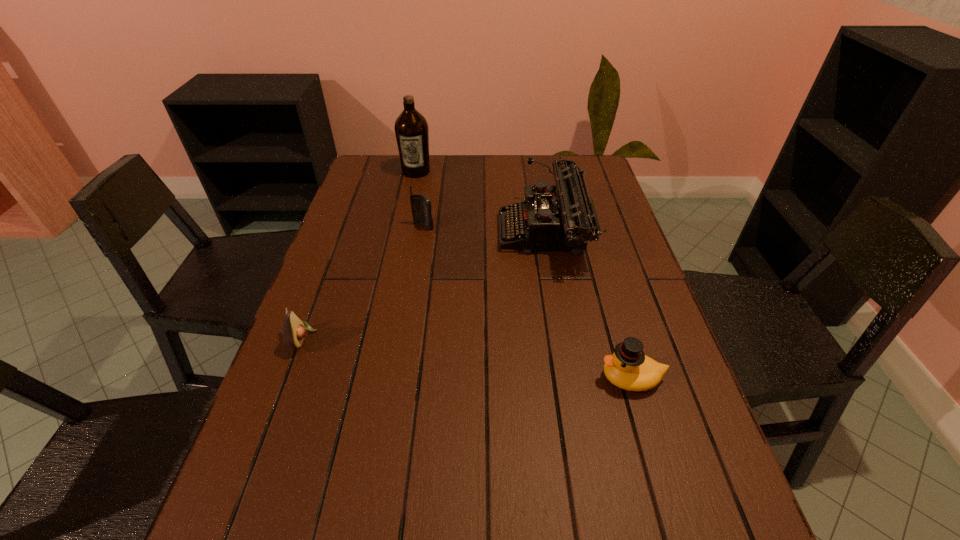
In order to click on duck that is positioned at the right edge in this screenshot , I will do `click(628, 368)`.

This screenshot has height=540, width=960. Find the location of `object that is at the far left corner`. object that is at the far left corner is located at coordinates (411, 128).

Find the location of a particular element. The width and height of the screenshot is (960, 540). free space at the far edge of the desktop is located at coordinates (522, 178).

In the image, there is a desktop. Where is `vacant space at the left edge`? vacant space at the left edge is located at coordinates (312, 363).

You are a GUI agent. You are given a task and a screenshot of the screen. Output one action in this format:
    pyautogui.click(x=<x>, y=<y>)
    Task: Click on the vacant point at the right edge
    
    Given the screenshot: What is the action you would take?
    pyautogui.click(x=647, y=284)

Find the location of `vacant area that lies between the cellular telephone and the typewriter`. vacant area that lies between the cellular telephone and the typewriter is located at coordinates 484,231.

Identify the location of free spot between the typewriter and the avocado. 423,286.

At what (x,y) coordinates should I click in order to perform the action: click on unoccupied position between the fourth shortest object and the second nearest object. Please return your answer as a coordinate pair (x, y). Looking at the image, I should click on (423, 286).

Locate an element on the screen. empty space that is in between the cellular telephone and the nearest object is located at coordinates (527, 302).

Image resolution: width=960 pixels, height=540 pixels. Find the location of `free space between the cellular telephone and the typewriter`. free space between the cellular telephone and the typewriter is located at coordinates (484, 231).